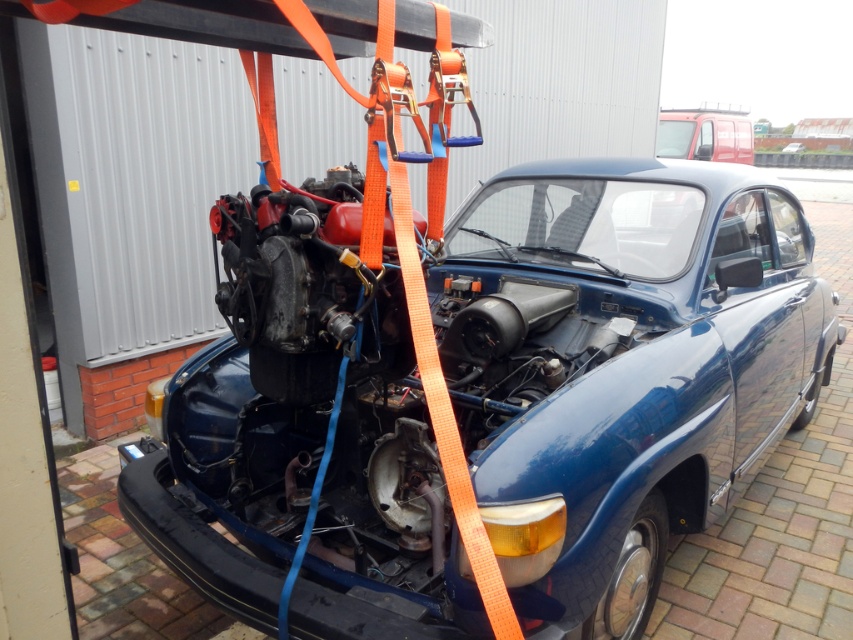
Question: Observing the image, what is the correct spatial positioning of glossy blue car at center in reference to blue matte car at center?

Choices:
 (A) left
 (B) right

Answer: (A)

Question: Is glossy blue car at center further to camera compared to blue matte car at center?

Choices:
 (A) no
 (B) yes

Answer: (A)

Question: Which object is farther from the camera taking this photo?

Choices:
 (A) glossy blue car at center
 (B) blue matte car at center

Answer: (B)

Question: Does glossy blue car at center lie behind blue matte car at center?

Choices:
 (A) no
 (B) yes

Answer: (A)

Question: Which point is closer to the camera?

Choices:
 (A) (785, 150)
 (B) (640, 292)

Answer: (B)